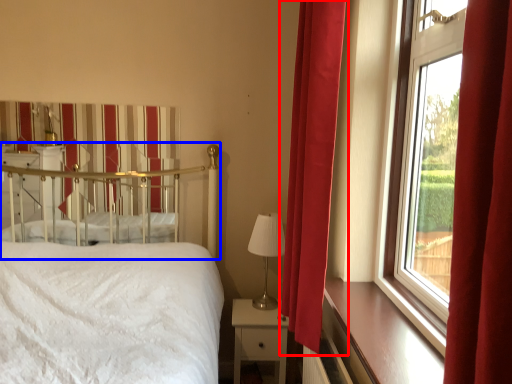
Question: Which of the following is the farthest to the observer, curtain (highlighted by a red box) or canopy bed (highlighted by a blue box)?

Choices:
 (A) curtain
 (B) canopy bed

Answer: (B)